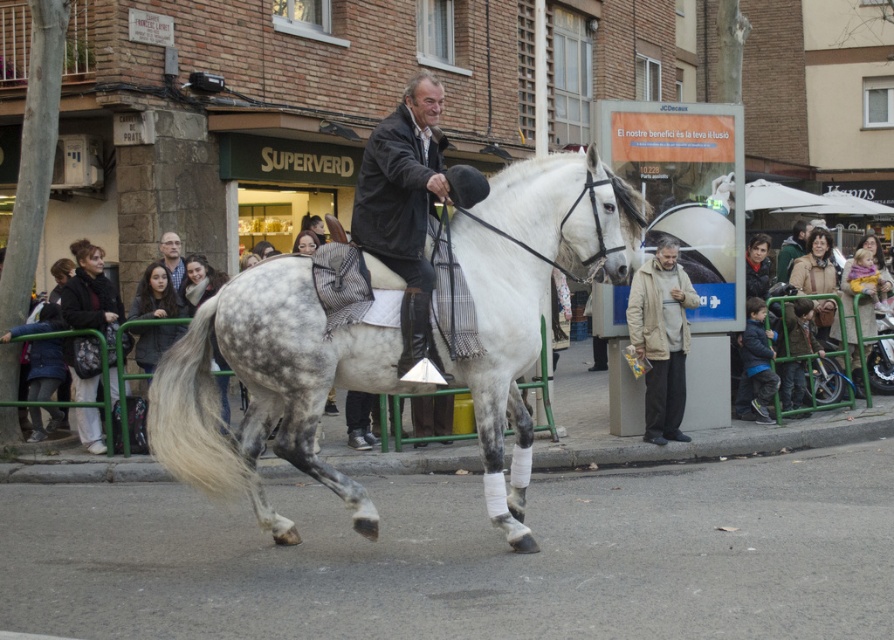
You are a photographer trying to capture the man on the white horse in the scene. You notice a point at coordinates (661, 337). What object is this point located on?

The point at coordinates (661, 337) is on the beige fabric jacket at right.

You are a fashion designer observing the street scene and notice the beige fabric jacket at right and the dark gray scarf at left. Which clothing item is located to the right of the other?

The beige fabric jacket at right is positioned on the right side of dark gray scarf at left.